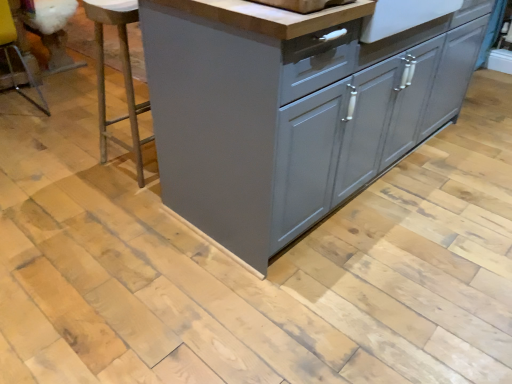
I want to click on vacant space in front of metallic silver bar stool at left, which is counted as the first bar stool, starting from the right, so click(x=116, y=198).